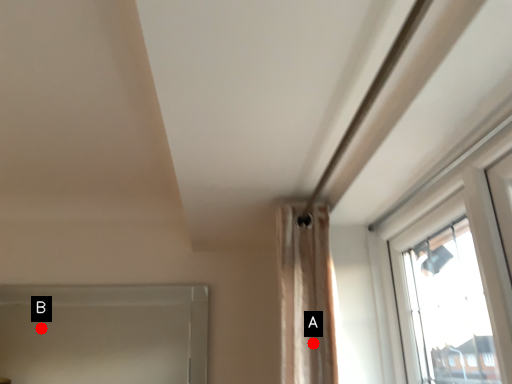
Question: Two points are circled on the image, labeled by A and B beside each circle. Which point appears closest to the camera in this image?

Choices:
 (A) A is closer
 (B) B is closer

Answer: (A)